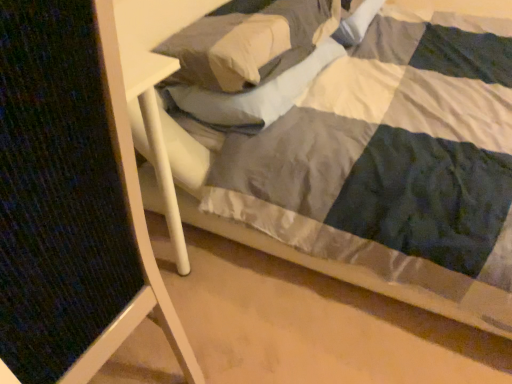
Question: Does textured fabric folding chair at left have a lesser height compared to soft white pillow at upper center?

Choices:
 (A) yes
 (B) no

Answer: (B)

Question: Considering the relative sizes of textured fabric folding chair at left and soft white pillow at upper center in the image provided, is textured fabric folding chair at left wider than soft white pillow at upper center?

Choices:
 (A) no
 (B) yes

Answer: (A)

Question: Can you confirm if textured fabric folding chair at left is thinner than soft white pillow at upper center?

Choices:
 (A) yes
 (B) no

Answer: (A)

Question: From a real-world perspective, is textured fabric folding chair at left located higher than soft white pillow at upper center?

Choices:
 (A) no
 (B) yes

Answer: (A)

Question: Could you tell me if textured fabric folding chair at left is facing soft white pillow at upper center?

Choices:
 (A) no
 (B) yes

Answer: (A)

Question: From the image's perspective, is textured fabric folding chair at left over soft white pillow at upper center?

Choices:
 (A) yes
 (B) no

Answer: (B)

Question: Does soft white pillow at upper center have a larger size compared to textured fabric folding chair at left?

Choices:
 (A) yes
 (B) no

Answer: (B)

Question: Considering the relative sizes of soft white pillow at upper center and textured fabric folding chair at left in the image provided, is soft white pillow at upper center smaller than textured fabric folding chair at left?

Choices:
 (A) no
 (B) yes

Answer: (B)

Question: From a real-world perspective, is soft white pillow at upper center on top of textured fabric folding chair at left?

Choices:
 (A) yes
 (B) no

Answer: (A)

Question: Is soft white pillow at upper center positioned beyond the bounds of textured fabric folding chair at left?

Choices:
 (A) no
 (B) yes

Answer: (B)

Question: Is soft white pillow at upper center placed right next to textured fabric folding chair at left?

Choices:
 (A) no
 (B) yes

Answer: (A)

Question: From the image's perspective, would you say soft white pillow at upper center is shown under textured fabric folding chair at left?

Choices:
 (A) no
 (B) yes

Answer: (A)

Question: From the image's perspective, is textured fabric folding chair at left positioned above or below soft white pillow at upper center?

Choices:
 (A) below
 (B) above

Answer: (A)